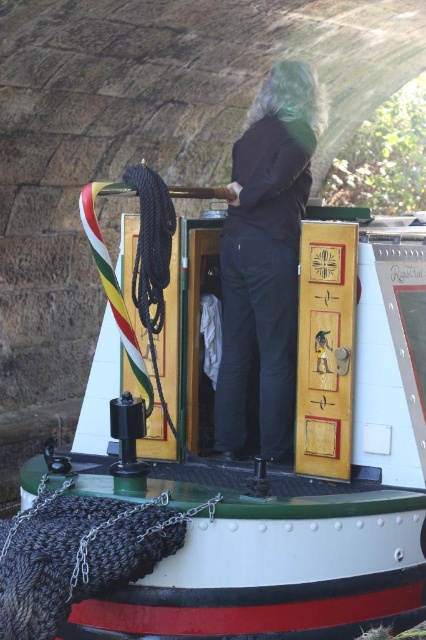
You are on the narrowboat and want to reach both points marked on the boat. Which point, point (252, 493) or point (273, 227), is closer to you?

Point (252, 493) is closer to the viewer than point (273, 227).

You are a passenger on the narrowboat and want to locate the point marked at coordinates (233, 460). Where would you find this point on the boat?

The point marked at coordinates (233, 460) is located on the white glossy boat at center.